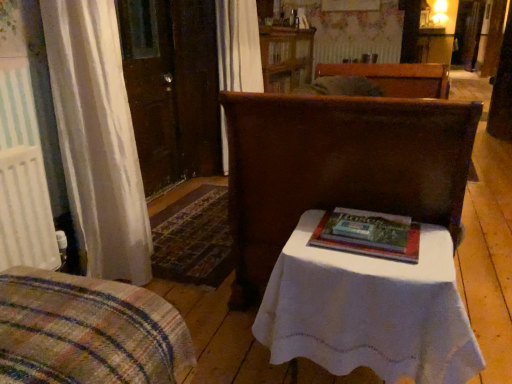
At what (x,y) coordinates should I click in order to perform the action: click on free space above hardcover book at center (from a real-world perspective). Please return your answer as a coordinate pair (x, y). Looking at the image, I should click on click(x=362, y=218).